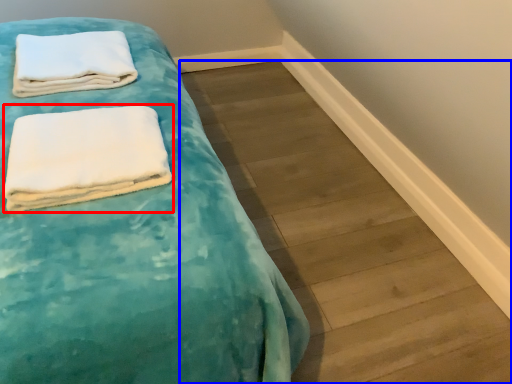
Question: Among these objects, which one is farthest to the camera, towel (highlighted by a red box) or plank (highlighted by a blue box)?

Choices:
 (A) towel
 (B) plank

Answer: (B)